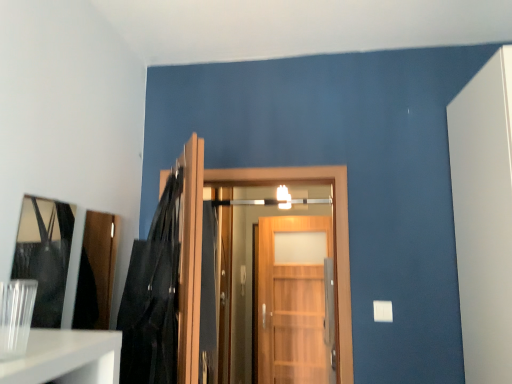
Identify the location of vacant area on top of wooden door at center, the first door viewed from the back (from a real-world perspective). (300, 215).